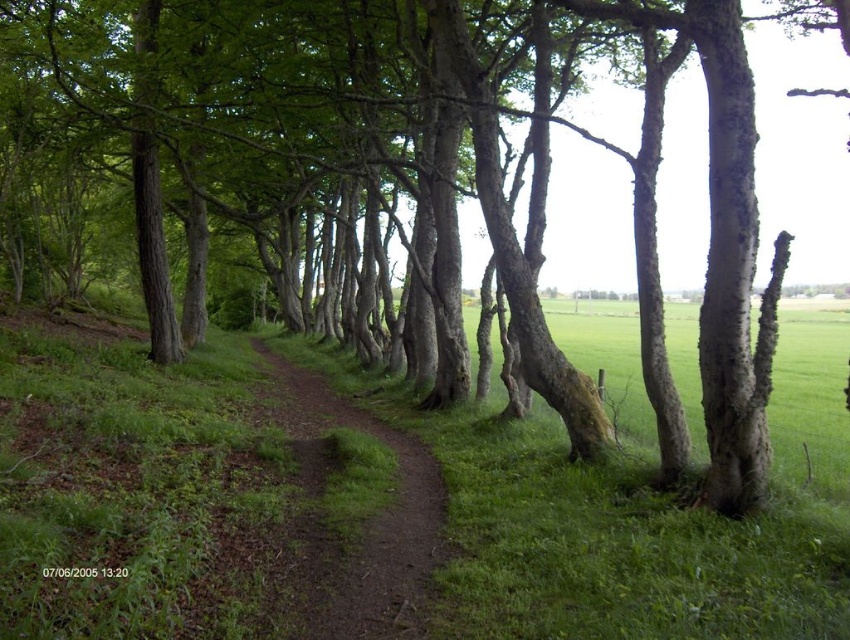
You are standing on the green grassy at center and want to walk to the brown dirt path at center. Which direction should you move to reach the path?

Since the green grassy at center is closer to the viewer than the brown dirt path at center, you should move backward to reach the brown dirt path at center.